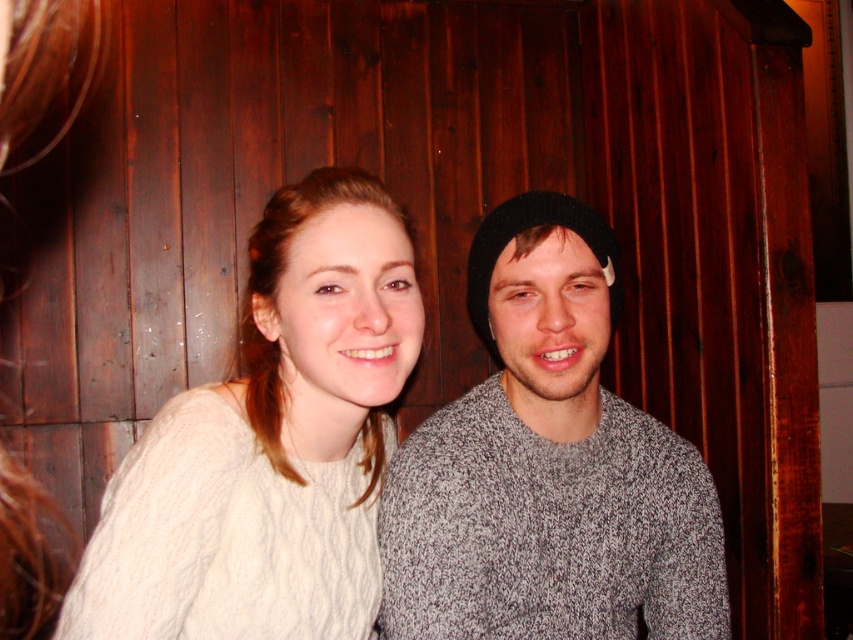
You are a photographer trying to focus on the white cable knit sweater at center. You notice a point marked at coordinates (270, 444). Is this point located on the white cable knit sweater at center?

Yes, the point at coordinates (270, 444) is located on the white cable knit sweater at center according to the description.